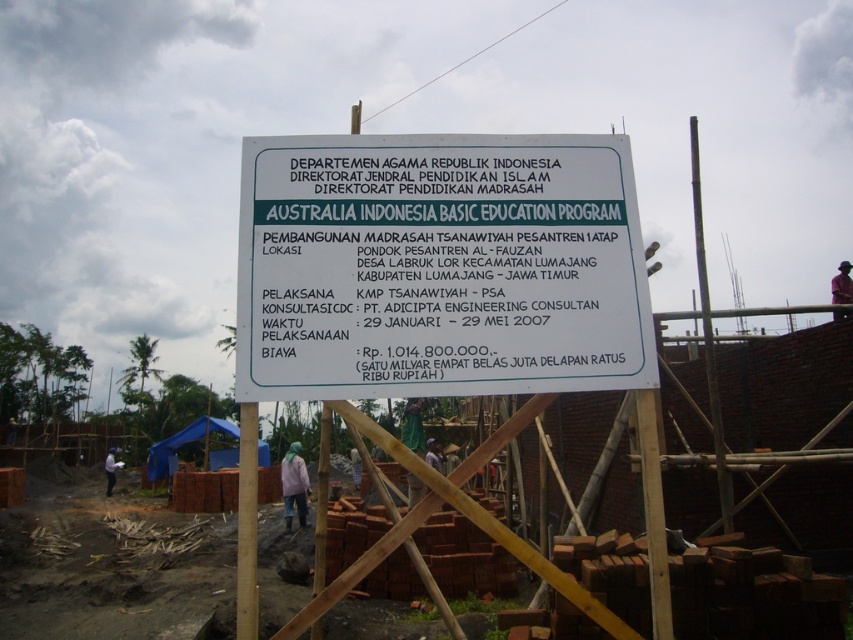
Who is higher up, white wooden sign at center or pink fabric at center?

Positioned higher is pink fabric at center.

Is point (73, 525) less distant than point (294, 465)?

No.

The width and height of the screenshot is (853, 640). Describe the element at coordinates (107, 563) in the screenshot. I see `white wooden sign at center` at that location.

You are a GUI agent. You are given a task and a screenshot of the screen. Output one action in this format:
    pyautogui.click(x=<x>, y=<y>)
    Task: Click on the white wooden sign at center
    
    Given the screenshot: What is the action you would take?
    pyautogui.click(x=107, y=563)

Is white plastic sign at center bigger than pink fabric at center?

No, white plastic sign at center is not bigger than pink fabric at center.

From the picture: Is white plastic sign at center positioned before pink fabric at center?

That is True.

Who is more distant from viewer, (x=490, y=192) or (x=306, y=524)?

The point (x=306, y=524) is more distant.

You are a GUI agent. You are given a task and a screenshot of the screen. Output one action in this format:
    pyautogui.click(x=<x>, y=<y>)
    Task: Click on the white plastic sign at center
    The height and width of the screenshot is (640, 853).
    Given the screenshot: What is the action you would take?
    pyautogui.click(x=439, y=266)

Is point (260, 186) behind point (410, 616)?

No, it is in front of (410, 616).

Is white plastic sign at center to the left of white wooden sign at center from the viewer's perspective?

Incorrect, white plastic sign at center is not on the left side of white wooden sign at center.

This screenshot has height=640, width=853. Describe the element at coordinates (439, 266) in the screenshot. I see `white plastic sign at center` at that location.

Identify the location of white plastic sign at center. This screenshot has height=640, width=853. (439, 266).